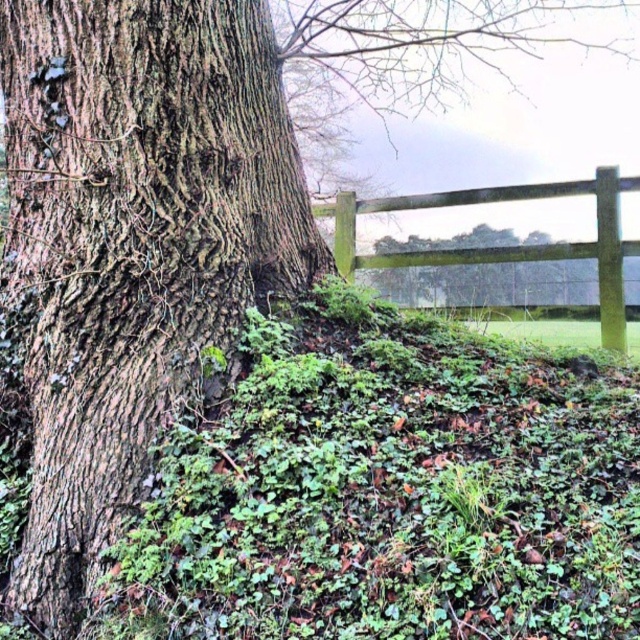
Can you confirm if brown rough bark tree trunk at left is positioned above green mossy tree at center?

No, brown rough bark tree trunk at left is not above green mossy tree at center.

Does brown rough bark tree trunk at left appear on the left side of green mossy tree at center?

Correct, you'll find brown rough bark tree trunk at left to the left of green mossy tree at center.

In order to click on brown rough bark tree trunk at left in this screenshot , I will do `click(134, 243)`.

Does brown rough bark tree trunk at left have a greater height compared to green wood fence at center?

Indeed, brown rough bark tree trunk at left has a greater height compared to green wood fence at center.

You are a GUI agent. You are given a task and a screenshot of the screen. Output one action in this format:
    pyautogui.click(x=<x>, y=<y>)
    Task: Click on the brown rough bark tree trunk at left
    
    Given the screenshot: What is the action you would take?
    pyautogui.click(x=134, y=243)

What are the coordinates of `brown rough bark tree trunk at left` in the screenshot? It's located at (134, 243).

Who is positioned more to the right, green wood fence at center or green mossy tree at center?

green mossy tree at center is more to the right.

Locate an element on the screen. The width and height of the screenshot is (640, 640). green wood fence at center is located at coordinates (506, 246).

Who is more forward, (598, 168) or (403, 291)?

Point (598, 168) is more forward.

I want to click on green wood fence at center, so 506,246.